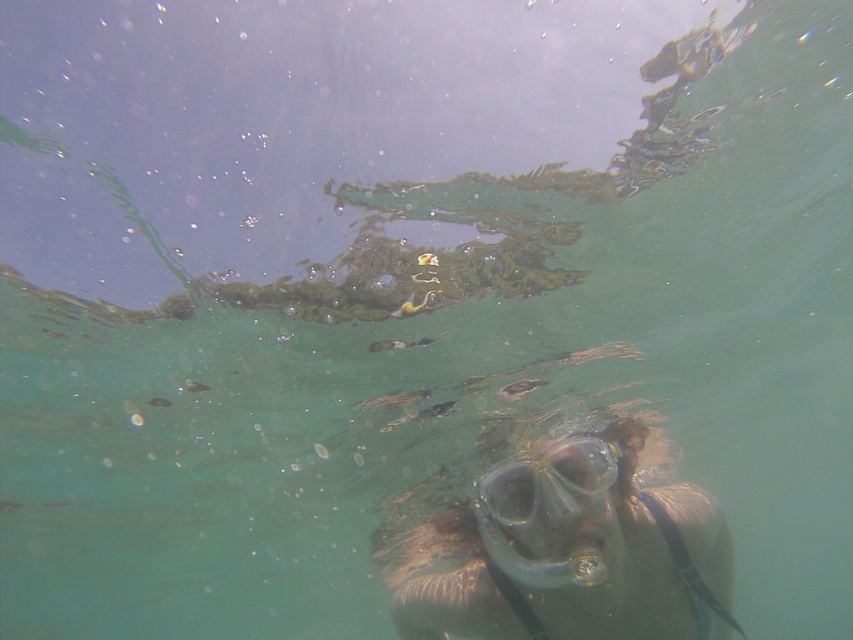
Question: Which of the following is the closest to the observer?

Choices:
 (A) (590, 481)
 (B) (698, 529)

Answer: (B)

Question: Which point is farther from the camera taking this photo?

Choices:
 (A) (543, 554)
 (B) (518, 499)

Answer: (B)

Question: Does clear plastic mask at center have a greater width compared to transparent plastic goggles at center?

Choices:
 (A) no
 (B) yes

Answer: (B)

Question: Is clear plastic mask at center behind transparent plastic goggles at center?

Choices:
 (A) no
 (B) yes

Answer: (A)

Question: In this image, where is clear plastic mask at center located relative to transparent plastic goggles at center?

Choices:
 (A) left
 (B) right

Answer: (B)